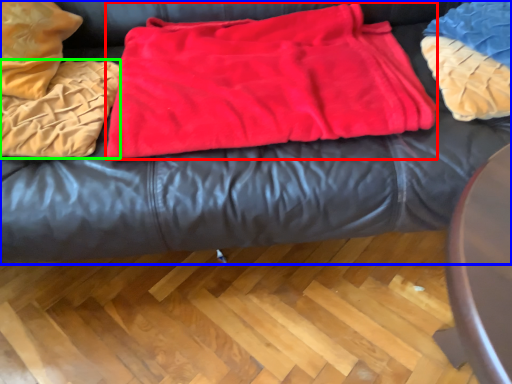
Question: Considering the real-world distances, which object is closest to blanket (highlighted by a red box)? furniture (highlighted by a blue box) or blanket (highlighted by a green box).

Choices:
 (A) furniture
 (B) blanket

Answer: (A)